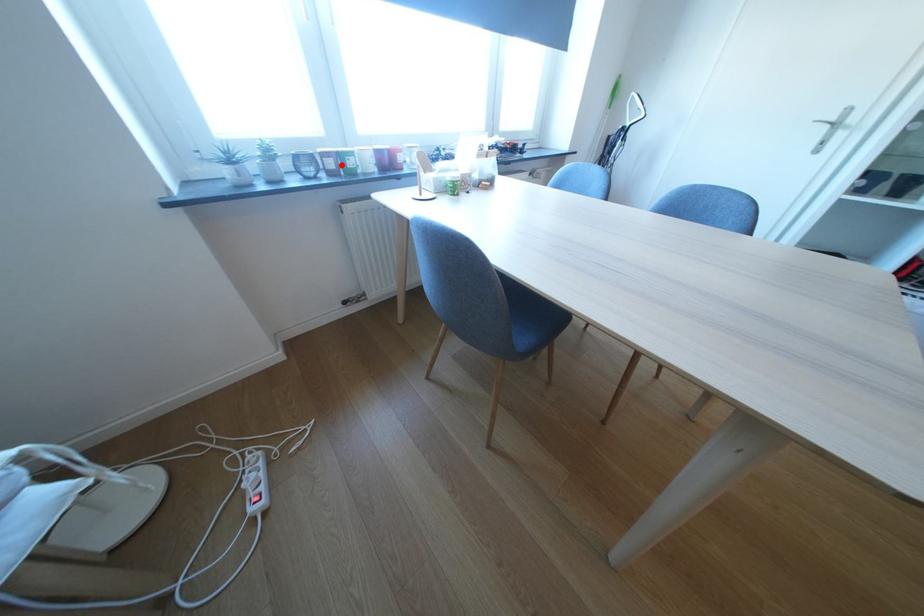
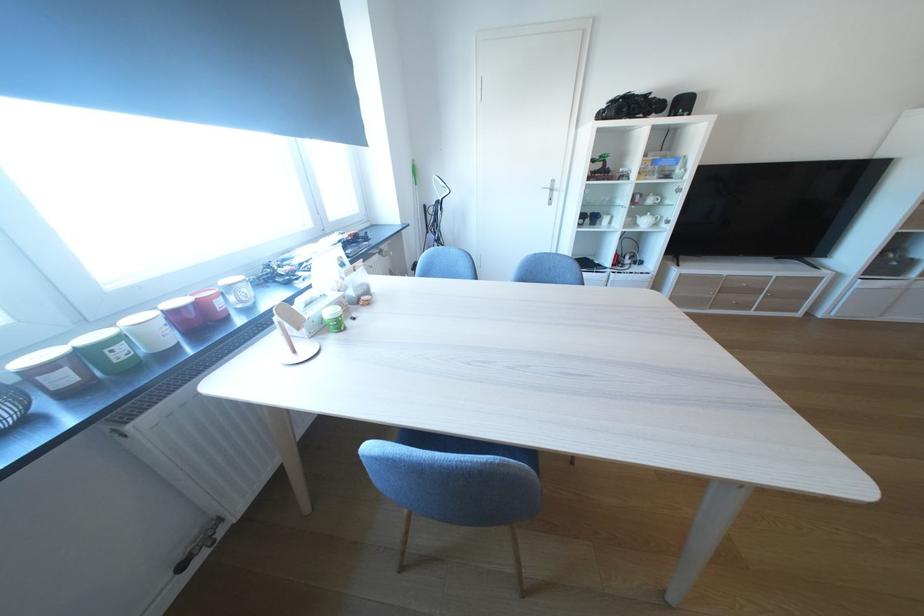
Question: I am providing you with two images of the same scene from different viewpoints. A red point is shown in image1. For the corresponding object point in image2, is it positioned nearer or farther from the camera?

Choices:
 (A) Nearer
 (B) Farther

Answer: (B)